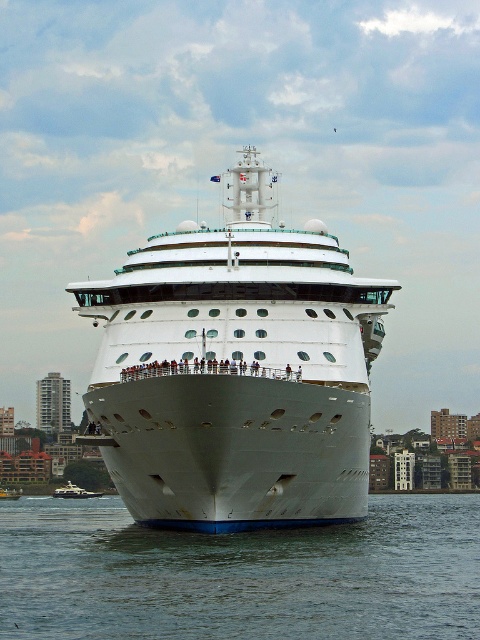
Question: Is white matte water at center positioned at the back of white matte boat at lower center?

Choices:
 (A) no
 (B) yes

Answer: (A)

Question: Based on their relative distances, which object is nearer to the white matte water at center?

Choices:
 (A) white glossy cruise ship at center
 (B) white matte boat at lower center

Answer: (A)

Question: Which point appears farthest from the camera in this image?

Choices:
 (A) (75, 492)
 (B) (123, 548)
 (C) (243, 413)
 (D) (10, 492)

Answer: (D)

Question: Which is nearer to the white glossy boat at center?

Choices:
 (A) white matte boat at lower center
 (B) white matte water at center
 (C) white glossy cruise ship at center

Answer: (A)

Question: Can you confirm if white matte water at center is wider than white glossy boat at center?

Choices:
 (A) yes
 (B) no

Answer: (A)

Question: Is white glossy cruise ship at center further to camera compared to white matte water at center?

Choices:
 (A) no
 (B) yes

Answer: (B)